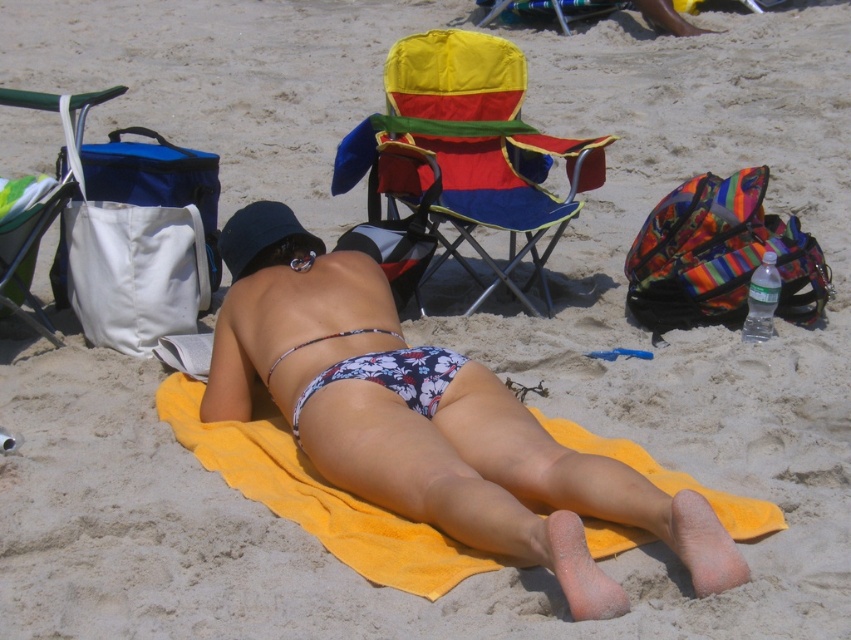
From the picture: You are a beachgoer trying to decide where to place your new small cooler bag. You see the multicolored fabric beach chair at center and the white fabric bag at left. Which object has enough space to fit the cooler next to it without moving the existing items?

The multicolored fabric beach chair at center has enough space to fit the cooler next to it because its width is larger than the white fabric bag at left.